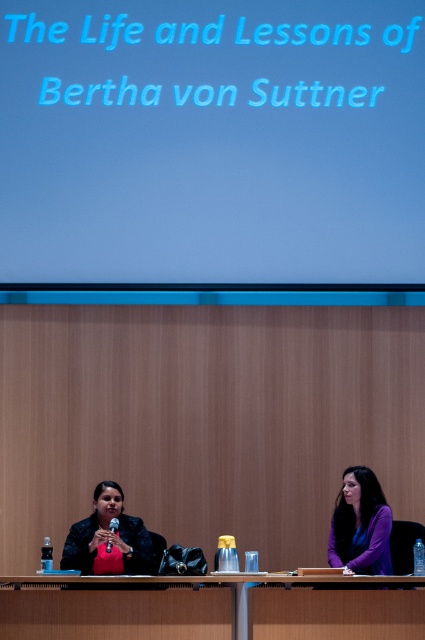
Question: Among these objects, which one is farthest from the camera?

Choices:
 (A) blue matte projection screen at upper center
 (B) purple fabric shirt at right

Answer: (A)

Question: Among these objects, which one is nearest to the camera?

Choices:
 (A) purple fabric shirt at right
 (B) wooden table at center
 (C) matte black jacket at center

Answer: (B)

Question: Can you confirm if wooden table at center is positioned to the left of matte black jacket at center?

Choices:
 (A) yes
 (B) no

Answer: (B)

Question: Is wooden table at center thinner than matte black jacket at center?

Choices:
 (A) no
 (B) yes

Answer: (A)

Question: Can you confirm if matte black jacket at center is positioned above purple fabric shirt at right?

Choices:
 (A) no
 (B) yes

Answer: (A)

Question: Considering the real-world distances, which object is farthest from the purple fabric shirt at right?

Choices:
 (A) matte black jacket at center
 (B) blue matte projection screen at upper center

Answer: (B)